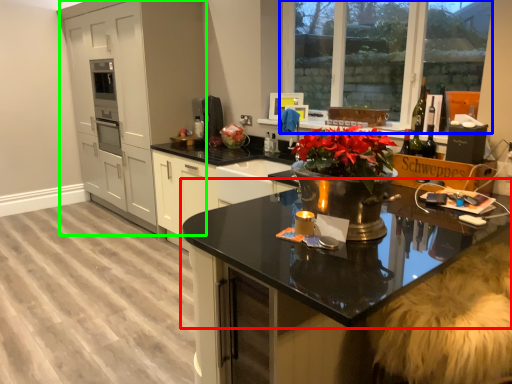
Question: Which object is the farthest from countertop (highlighted by a red box)? Choose among these: window (highlighted by a blue box) or cabinetry (highlighted by a green box).

Choices:
 (A) window
 (B) cabinetry

Answer: (A)